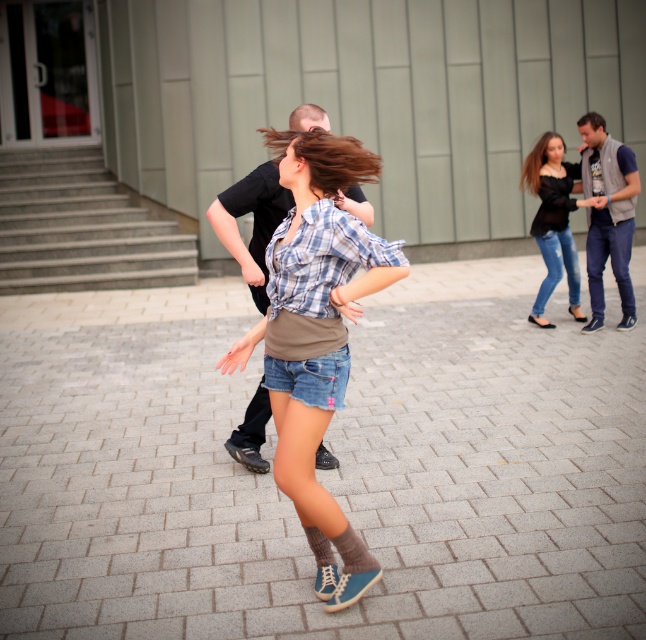
Who is taller, denim shorts at center or smooth brown hair at upper right?

denim shorts at center

Is denim shorts at center above smooth brown hair at upper right?

Incorrect, denim shorts at center is not positioned above smooth brown hair at upper right.

Does point (282, 404) come in front of point (587, 122)?

Yes, it is.

The height and width of the screenshot is (640, 646). What are the coordinates of `denim shorts at center` in the screenshot? It's located at (317, 333).

Does brown matte hair at center appear over smooth brown hair at upper right?

No, brown matte hair at center is not above smooth brown hair at upper right.

Does brown matte hair at center appear under smooth brown hair at upper right?

Yes, brown matte hair at center is below smooth brown hair at upper right.

Where is `brown matte hair at center`? Image resolution: width=646 pixels, height=640 pixels. brown matte hair at center is located at coordinates (326, 157).

Image resolution: width=646 pixels, height=640 pixels. Identify the location of brown matte hair at center. (326, 157).

Does denim shorts at center have a lesser height compared to black matte shirt at upper right?

No, denim shorts at center is not shorter than black matte shirt at upper right.

In the scene shown: Is denim shorts at center smaller than black matte shirt at upper right?

No, denim shorts at center is not smaller than black matte shirt at upper right.

Find the location of a particular element. This screenshot has width=646, height=640. denim shorts at center is located at coordinates [x=317, y=333].

The image size is (646, 640). Identify the location of denim shorts at center. (317, 333).